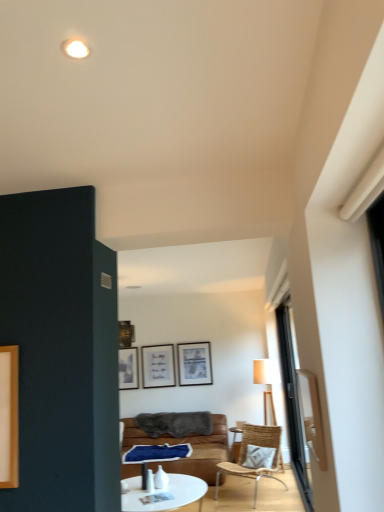
Image resolution: width=384 pixels, height=512 pixels. What do you see at coordinates (311, 415) in the screenshot?
I see `transparent glass door at right` at bounding box center [311, 415].

Image resolution: width=384 pixels, height=512 pixels. What do you see at coordinates (164, 493) in the screenshot? I see `white glossy coffee table at center` at bounding box center [164, 493].

The image size is (384, 512). I want to click on white textured pillow at lower right, so click(x=259, y=457).

The image size is (384, 512). What do you see at coordinates (255, 456) in the screenshot?
I see `woven wood chair at center` at bounding box center [255, 456].

You are a GUI agent. You are given a task and a screenshot of the screen. Output one action in this format:
    pyautogui.click(x=<x>, y=<y>)
    Task: Click on the transparent glass door at right
    
    Given the screenshot: What is the action you would take?
    pyautogui.click(x=311, y=415)

From a real-world perspective, relative to transparent glass door at right, is brown leather couch at center vertically above or below?

brown leather couch at center is below transparent glass door at right.

Considering the positions of points (146, 439) and (325, 452), is point (146, 439) closer to camera compared to point (325, 452)?

That is False.

Based on the photo, which is more to the left, brown leather couch at center or transparent glass door at right?

From the viewer's perspective, brown leather couch at center appears more on the left side.

Considering the sizes of objects brown leather couch at center and transparent glass door at right in the image provided, who is taller, brown leather couch at center or transparent glass door at right?

With more height is brown leather couch at center.

From the image's perspective, which is above, woven wood chair at center or matte black picture frame at upper center?

matte black picture frame at upper center, from the image's perspective.

Considering the positions of objects woven wood chair at center and matte black picture frame at upper center in the image provided, who is in front, woven wood chair at center or matte black picture frame at upper center?

woven wood chair at center is more forward.

Is woven wood chair at center turned away from matte black picture frame at upper center?

No.

Is transparent glass door at right looking in the opposite direction of matte black picture frame at upper center?

No.

Are transparent glass door at right and matte black picture frame at upper center far apart?

That's right, there is a large distance between transparent glass door at right and matte black picture frame at upper center.

Locate an element on the screen. picture frame above the transparent glass door at right (from the image's perspective) is located at coordinates (194, 364).

From the picture: Which object is thinner, transparent glass door at right or matte black picture frame at upper center?

Thinner between the two is matte black picture frame at upper center.

Identify the location of pillow located on the right of matte black picture frame at upper center. The height and width of the screenshot is (512, 384). (259, 457).

Which of these two, matte black picture frame at upper center or white textured pillow at lower right, is thinner?

matte black picture frame at upper center is thinner.

Considering the relative positions of matte black picture frame at upper center and white textured pillow at lower right in the image provided, is matte black picture frame at upper center to the left of white textured pillow at lower right from the viewer's perspective?

Correct, you'll find matte black picture frame at upper center to the left of white textured pillow at lower right.

From the image's perspective, which one is positioned lower, matte black picture frame at upper center or transparent glass door at right?

transparent glass door at right.

Considering the positions of objects matte black picture frame at upper center and transparent glass door at right in the image provided, who is more to the right, matte black picture frame at upper center or transparent glass door at right?

Positioned to the right is transparent glass door at right.

From a real-world perspective, is matte black picture frame at upper center under transparent glass door at right?

No, from a real-world perspective, matte black picture frame at upper center is not below transparent glass door at right.

From a real-world perspective, who is located higher, brown leather couch at center or white textured pillow at lower right?

In real-world perspective, white textured pillow at lower right is above.

Considering the relative sizes of brown leather couch at center and white textured pillow at lower right in the image provided, is brown leather couch at center bigger than white textured pillow at lower right?

Yes.

Who is taller, brown leather couch at center or white textured pillow at lower right?

brown leather couch at center is taller.

Considering the positions of points (186, 468) and (245, 466), is point (186, 468) farther from camera compared to point (245, 466)?

No, it is not.

What's the angular difference between woven wood chair at center and transparent glass door at right's facing directions?

The facing directions of woven wood chair at center and transparent glass door at right are 56.6 degrees apart.

Is woven wood chair at center shorter than transparent glass door at right?

→ Correct, woven wood chair at center is not as tall as transparent glass door at right.

Is point (275, 453) closer to camera compared to point (294, 454)?

No, (275, 453) is further to viewer.

Considering the relative positions of woven wood chair at center and transparent glass door at right in the image provided, is woven wood chair at center to the left or to the right of transparent glass door at right?

Clearly, woven wood chair at center is on the left of transparent glass door at right in the image.

Find the location of `studio couch behind the transparent glass door at right`. studio couch behind the transparent glass door at right is located at coordinates (191, 445).

Identify the location of chair that is on the right side of matte black picture frame at upper center. (255, 456).

Based on their spatial positions, is transparent glass door at right or white textured pillow at lower right closer to woven wood chair at center?

The object closer to woven wood chair at center is white textured pillow at lower right.

Based on their spatial positions, is transparent glass door at right or white glossy coffee table at center further from matte black picture frame at upper center?

The object further to matte black picture frame at upper center is transparent glass door at right.

Based on their spatial positions, is white glossy coffee table at center or brown leather couch at center closer to transparent glass door at right?

Based on the image, white glossy coffee table at center appears to be nearer to transparent glass door at right.

Estimate the real-world distances between objects in this image. Which object is further from transparent glass door at right, white glossy coffee table at center or transparent glass door at right?

The object further to transparent glass door at right is white glossy coffee table at center.

From the image, which object appears to be farther from white glossy coffee table at center, woven wood chair at center or transparent glass door at right?

transparent glass door at right is positioned further to the anchor white glossy coffee table at center.

Consider the image. From the image, which object appears to be nearer to brown leather couch at center, transparent glass door at right or white textured pillow at lower right?

white textured pillow at lower right.

Based on their spatial positions, is woven wood chair at center or transparent glass door at right further from white textured pillow at lower right?

Based on the image, transparent glass door at right appears to be further to white textured pillow at lower right.

Looking at the image, which one is located closer to woven wood chair at center, white textured pillow at lower right or transparent glass door at right?

white textured pillow at lower right is closer to woven wood chair at center.

Find the location of a particular element. pillow between transparent glass door at right and woven wood chair at center in the up-down direction is located at coordinates (259, 457).

Image resolution: width=384 pixels, height=512 pixels. I want to click on chair between transparent glass door at right and matte black picture frame at upper center from front to back, so click(255, 456).

Identify the location of studio couch between white glossy coffee table at center and matte black picture frame at upper center along the z-axis. (191, 445).

Identify the location of window between transparent glass door at right and brown leather couch at center along the z-axis. The width and height of the screenshot is (384, 512). (293, 406).